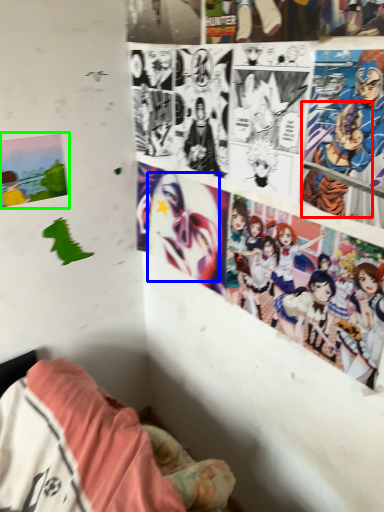
Question: Which object is the closest to the person (highlighted by a red box)? Choose among these: human face (highlighted by a blue box) or poster page (highlighted by a green box).

Choices:
 (A) human face
 (B) poster page

Answer: (A)